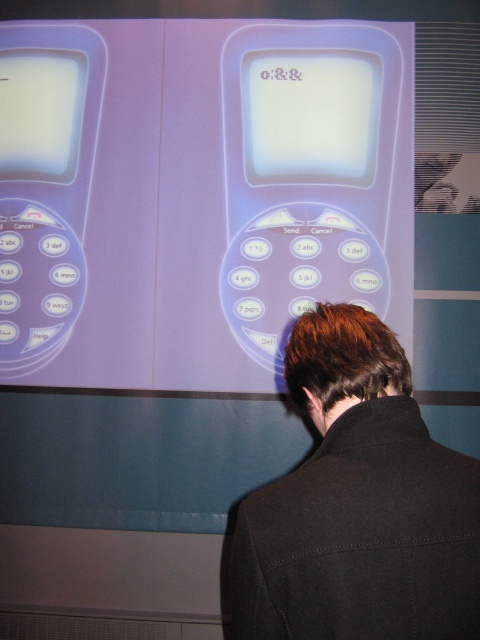
You are a user trying to send a message on the phone. You notice the white glossy screen at upper left and the matte white button at center. Which object should you press to send the message?

The matte white button at center should be pressed to send the message, as it is positioned at the center and typically buttons in this location are used for sending or confirming actions.